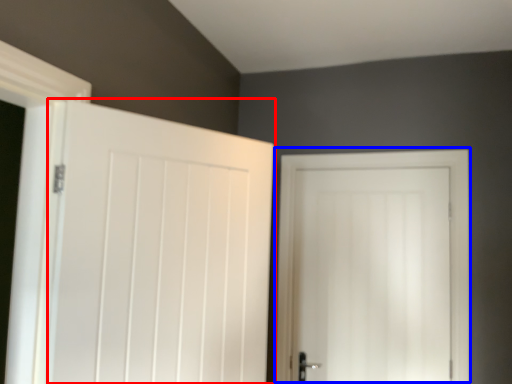
Question: Which object is further to the camera taking this photo, door (highlighted by a red box) or door (highlighted by a blue box)?

Choices:
 (A) door
 (B) door

Answer: (B)